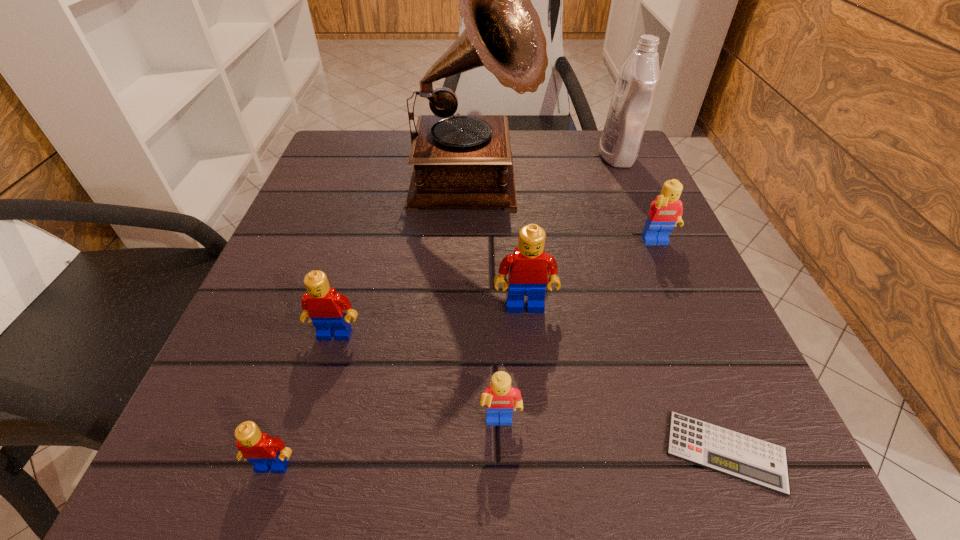
What are the coordinates of `the smaller yellow Lego` in the screenshot? It's located at 500,398.

Locate an element on the screen. The width and height of the screenshot is (960, 540). the left yellow Lego is located at coordinates (500, 398).

The image size is (960, 540). Identify the location of the smallest red Lego. (266, 454).

In order to click on the nearest Lego in this screenshot , I will do `click(266, 454)`.

Find the location of a particular element. the shortest object is located at coordinates (740, 456).

At what (x,y) coordinates should I click in order to perform the action: click on vacant space located 0.110m on the horn of the tallest object. Please return your answer as a coordinate pair (x, y). This screenshot has width=960, height=540. Looking at the image, I should click on (588, 187).

The height and width of the screenshot is (540, 960). What are the coordinates of `vacant space located 0.270m on the left of the detergent` in the screenshot? It's located at (475, 156).

The width and height of the screenshot is (960, 540). What are the coordinates of `vacant space located on the front-facing side of the third tallest object` in the screenshot? It's located at (534, 401).

Locate an element on the screen. The width and height of the screenshot is (960, 540). free space located on the face of the farthest Lego is located at coordinates (702, 346).

Locate an element on the screen. This screenshot has width=960, height=540. free space located 0.200m on the front-facing side of the second farthest red Lego is located at coordinates (289, 494).